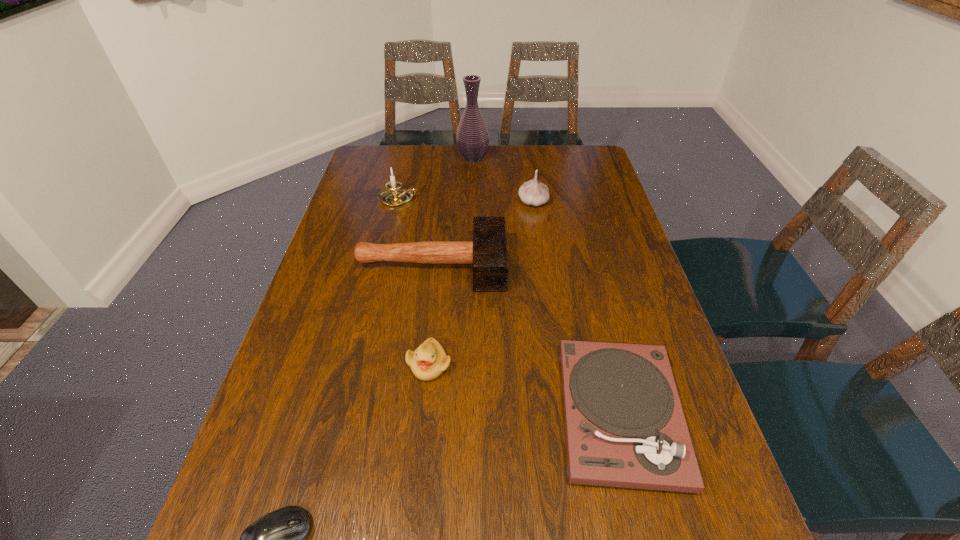
Identify the location of vacant area that satisfies the following two spatial constraints: 1. on the front-facing side of the duckling; 2. on the right side of the phonograph_record. (x=424, y=414).

Find the location of a particular element. This screenshot has height=540, width=960. free location that satisfies the following two spatial constraints: 1. on the handle side of the candle holder; 2. on the back side of the garlic is located at coordinates (397, 202).

At what (x,y) coordinates should I click in order to perform the action: click on blank area in the image that satisfies the following two spatial constraints: 1. on the hammer head face of the phonograph_record; 2. on the left side of the fourth nearest object. Please return your answer as a coordinate pair (x, y). Image resolution: width=960 pixels, height=540 pixels. Looking at the image, I should click on (415, 414).